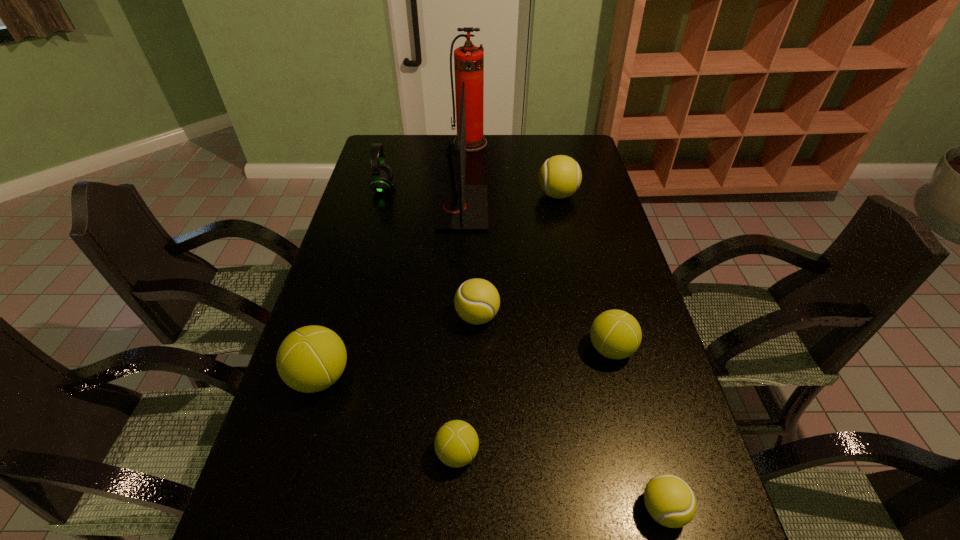
This screenshot has width=960, height=540. I want to click on the farthest object, so click(468, 60).

This screenshot has width=960, height=540. I want to click on fire extinguisher, so click(x=468, y=60).

The width and height of the screenshot is (960, 540). What are the coordinates of `black monitor` in the screenshot? It's located at (457, 207).

This screenshot has width=960, height=540. I want to click on monitor, so click(x=457, y=207).

You are a GUI agent. You are given a task and a screenshot of the screen. Output one action in this format:
    pyautogui.click(x=<x>, y=<y>)
    Task: Click on the headset
    
    Given the screenshot: What is the action you would take?
    pyautogui.click(x=382, y=174)

Find the location of `the biggest yellow tennis ball`. the biggest yellow tennis ball is located at coordinates (560, 176).

Identify the location of the farthest yellow tennis ball. This screenshot has width=960, height=540. (560, 176).

You are a GUI agent. You are given a task and a screenshot of the screen. Output one action in this format:
    pyautogui.click(x=<x>, y=<y>)
    Task: Click on the leftmost tennis ball
    The image size is (960, 540).
    Given the screenshot: What is the action you would take?
    pyautogui.click(x=312, y=358)

Identify the location of the biggest green tennis ball. (312, 358).

This screenshot has height=540, width=960. Identify the location of the second farthest yellow tennis ball. (477, 301).